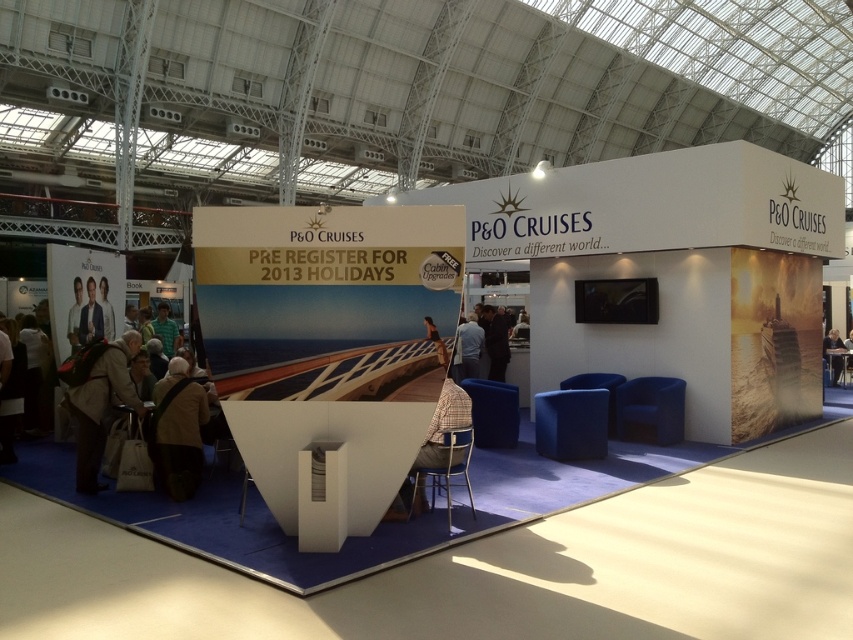
Question: Which object is positioned farthest from the dark blue fabric at center?

Choices:
 (A) brown leather jacket at lower left
 (B) brown fabric bag at lower left
 (C) light brown leather chair at lower right

Answer: (C)

Question: From the image, what is the correct spatial relationship of brown fabric bag at lower left in relation to light brown leather chair at lower right?

Choices:
 (A) below
 (B) above

Answer: (B)

Question: Can you confirm if brown leather jacket at lower left is positioned to the left of light brown leather chair at lower right?

Choices:
 (A) yes
 (B) no

Answer: (A)

Question: Can you confirm if dark blue fabric at center is thinner than light brown leather chair at lower right?

Choices:
 (A) yes
 (B) no

Answer: (A)

Question: Which object appears farthest from the camera in this image?

Choices:
 (A) brown leather jacket at lower left
 (B) light brown leather chair at lower right

Answer: (B)

Question: Among these objects, which one is farthest from the camera?

Choices:
 (A) light brown leather chair at lower right
 (B) brown leather jacket at lower left

Answer: (A)